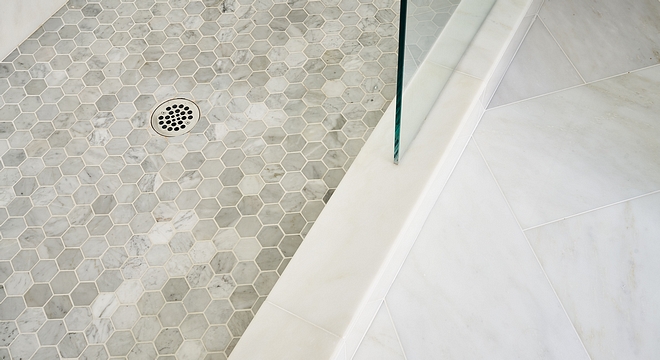
Locate an element on the screen. front of glass door is located at coordinates (435, 28).